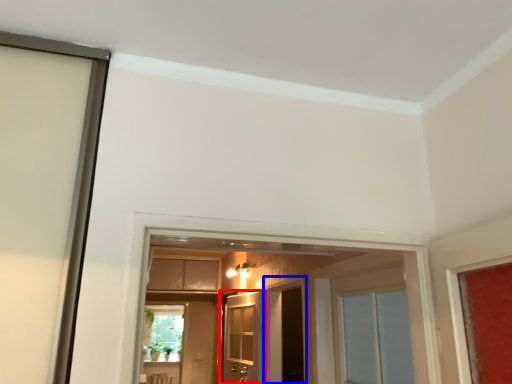
Question: Which object is further to the camera taking this photo, door (highlighted by a red box) or screen door (highlighted by a blue box)?

Choices:
 (A) door
 (B) screen door

Answer: (B)